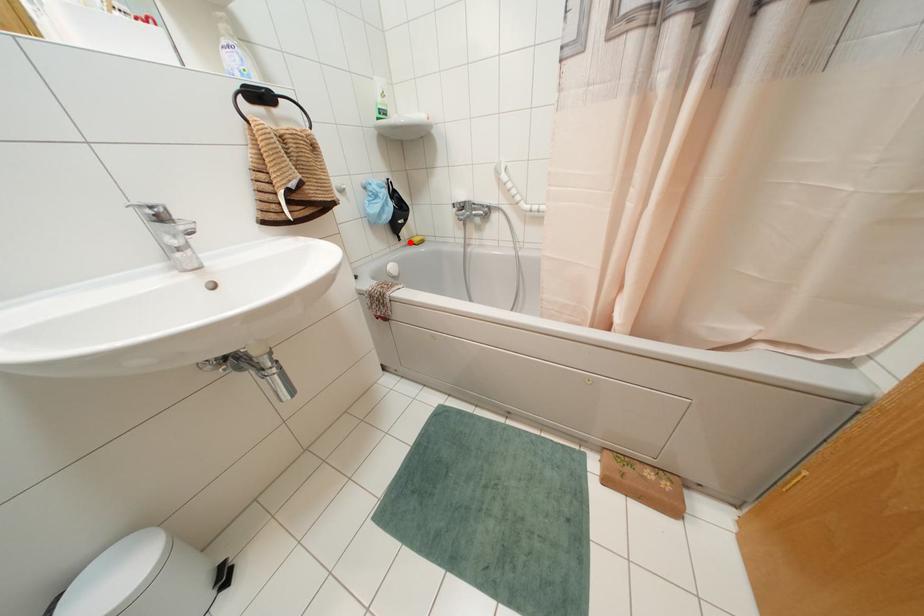
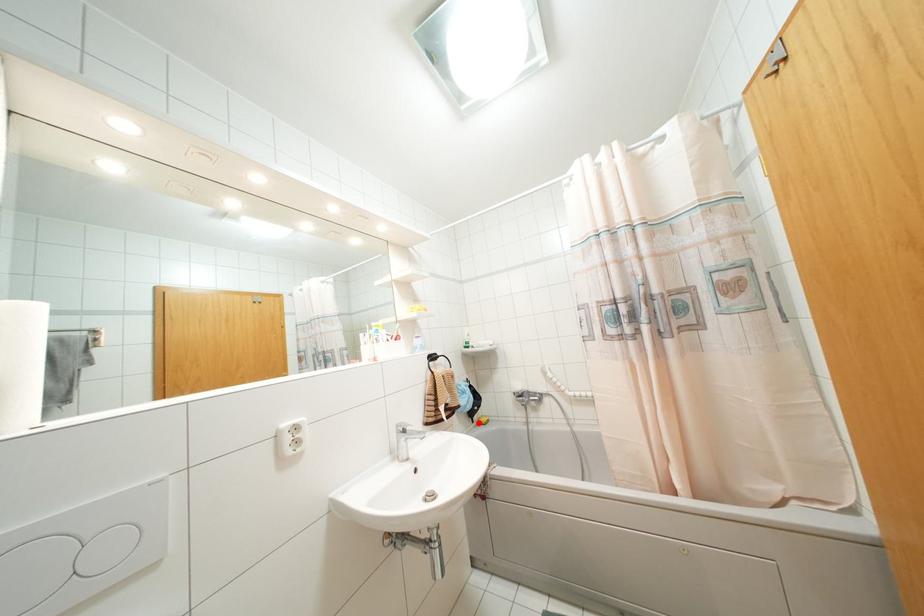
I am providing you with two images of the same scene from different viewpoints. A red point is marked on the first image and another point is marked on the second image. Is the red point in image1 aligned with the point shown in image2?

Yes